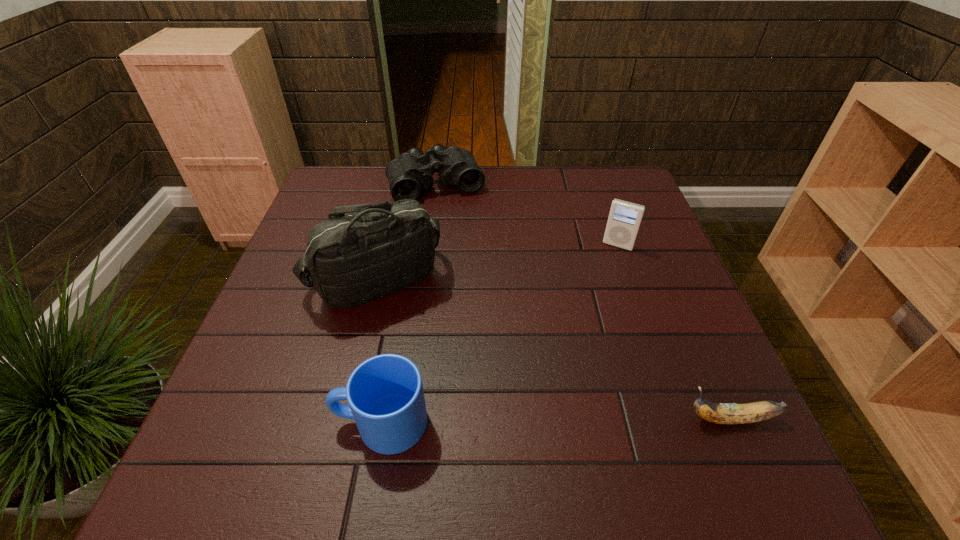
Where is `blank area located 0.120m at the stem of the shortest object`? Image resolution: width=960 pixels, height=540 pixels. blank area located 0.120m at the stem of the shortest object is located at coordinates (618, 419).

Locate an element on the screen. The width and height of the screenshot is (960, 540). vacant region located 0.160m on the front-facing side of the iPod is located at coordinates (596, 291).

The height and width of the screenshot is (540, 960). Identify the location of vacant space situated 0.350m on the front-facing side of the iPod. (570, 349).

Locate an element on the screen. This screenshot has width=960, height=540. vacant space located on the front-facing side of the iPod is located at coordinates (599, 282).

Find the location of a particular element. free space located at the front padded panel of the shoulder bag is located at coordinates (480, 368).

Find the location of a particular element. This screenshot has height=540, width=960. free space located 0.220m at the front padded panel of the shoulder bag is located at coordinates (480, 368).

Where is `vacant area situated 0.250m at the front padded panel of the shoulder bag`? Image resolution: width=960 pixels, height=540 pixels. vacant area situated 0.250m at the front padded panel of the shoulder bag is located at coordinates (491, 377).

Identify the location of vacant space situated 0.160m at the eyepieces of the farthest object. (462, 239).

At what (x,y) coordinates should I click in order to perform the action: click on blank area located 0.110m at the eyepieces of the farthest object. Please return your answer as a coordinate pair (x, y). The width and height of the screenshot is (960, 540). Looking at the image, I should click on (457, 228).

Locate an element on the screen. free region located at the eyepieces of the farthest object is located at coordinates (462, 239).